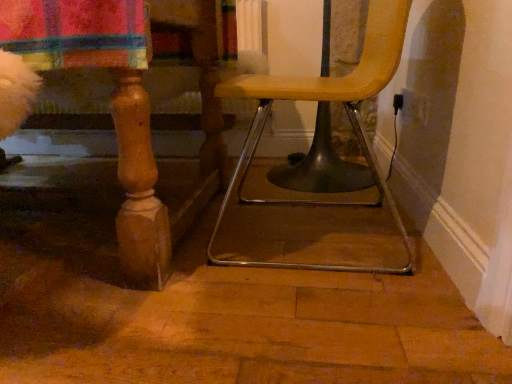
Where is `vacant area that is in front of wooden chair at center`? vacant area that is in front of wooden chair at center is located at coordinates (306, 316).